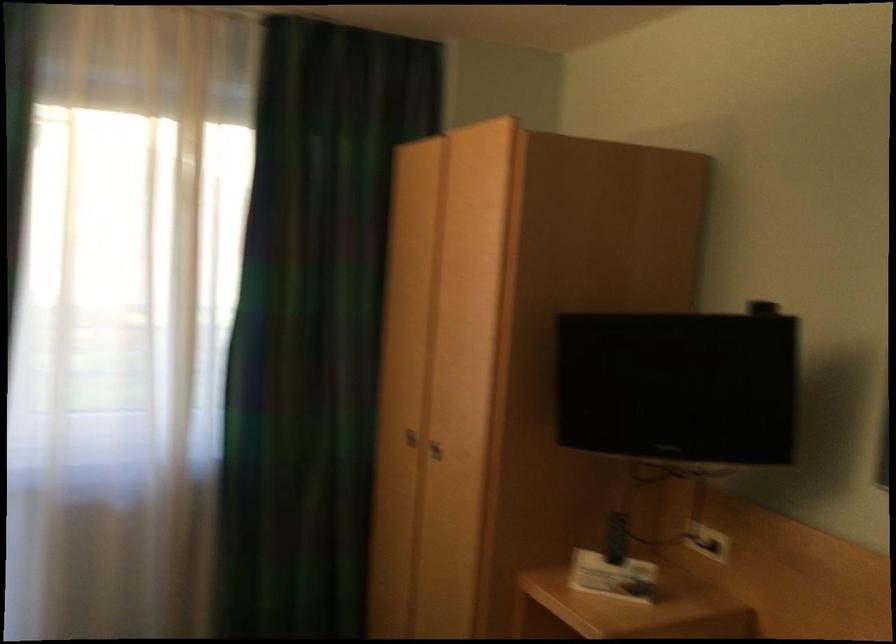
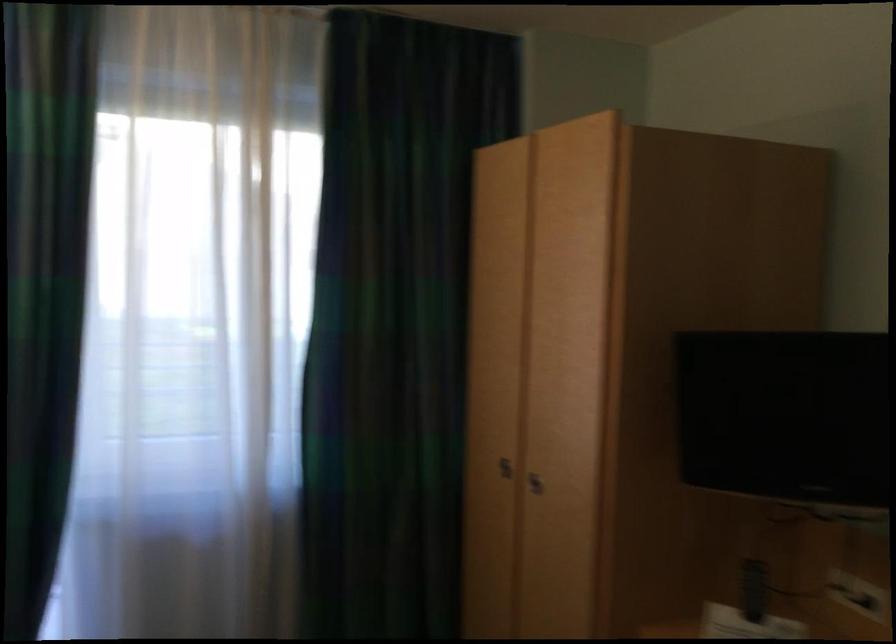
In the second image, find the point that corresponds to the point at 437,453 in the first image.

(535, 483)